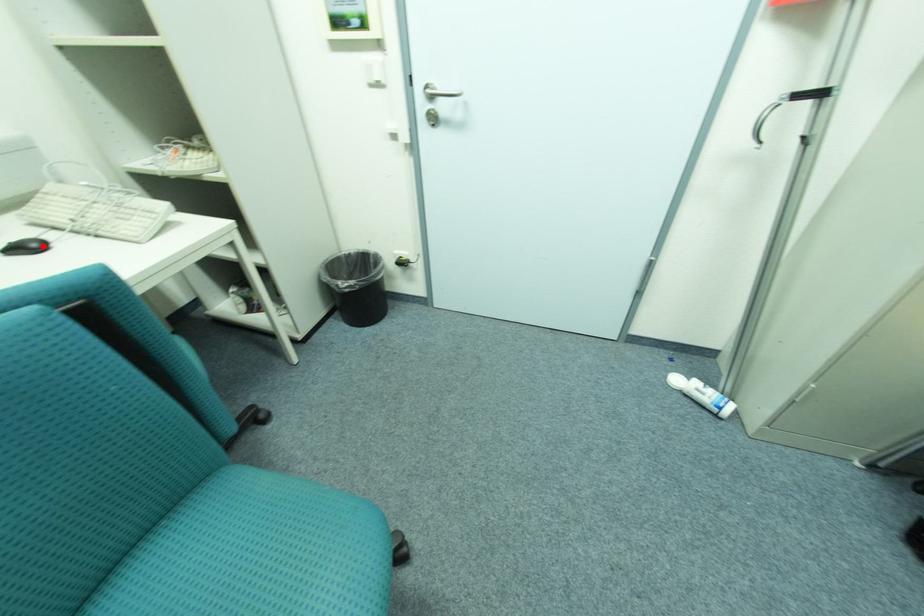
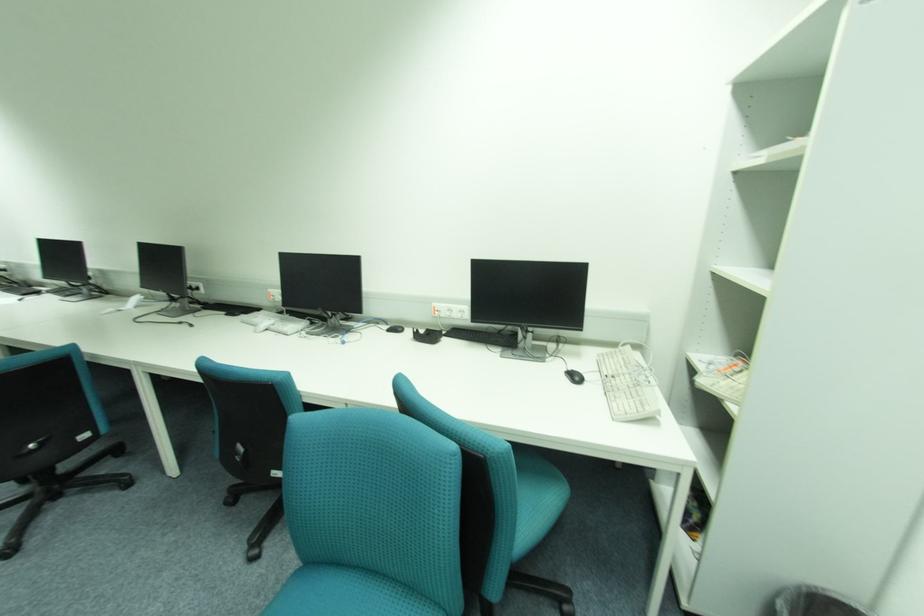
Question: I am providing you with two images of the same scene from different viewpoints. A red point is marked on the first image. Can you still see the location of the red point in image 2?

Choices:
 (A) Yes
 (B) No

Answer: (A)